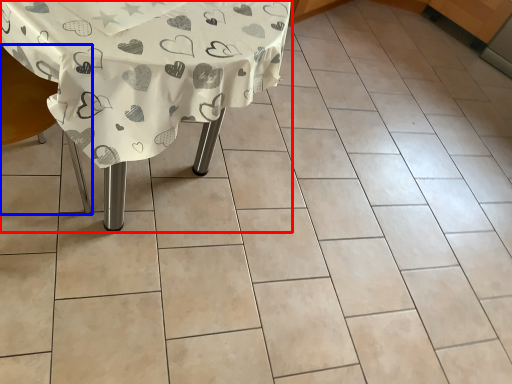
Question: Which point is closer to the camera, table (highlighted by a red box) or armchair (highlighted by a blue box)?

Choices:
 (A) table
 (B) armchair

Answer: (B)